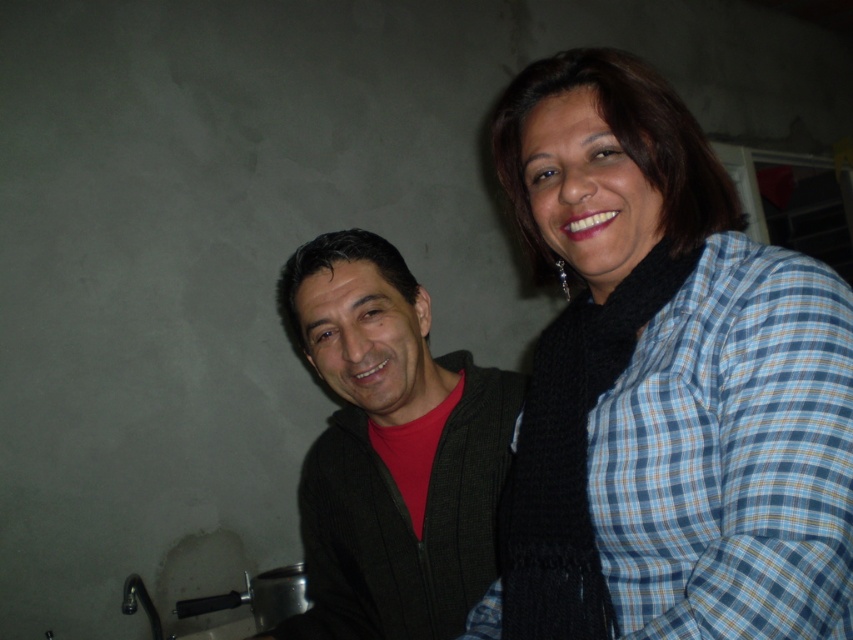
Question: Does blue plaid shirt at upper right have a smaller size compared to dark green sweater at center?

Choices:
 (A) no
 (B) yes

Answer: (A)

Question: Is blue plaid shirt at upper right positioned in front of dark green sweater at center?

Choices:
 (A) yes
 (B) no

Answer: (A)

Question: Which point appears closest to the camera in this image?

Choices:
 (A) (656, 353)
 (B) (456, 445)

Answer: (A)

Question: Among these points, which one is nearest to the camera?

Choices:
 (A) (813, 502)
 (B) (358, 483)

Answer: (A)

Question: Can you confirm if blue plaid shirt at upper right is positioned below dark green sweater at center?

Choices:
 (A) yes
 (B) no

Answer: (B)